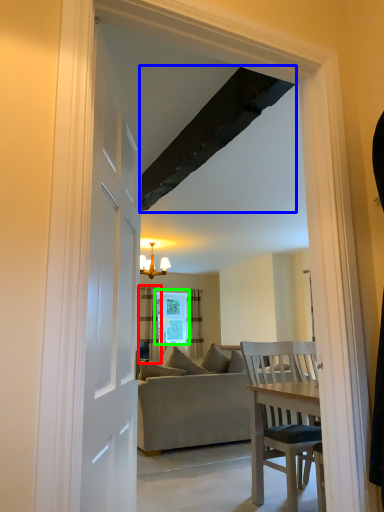
Question: Based on their relative distances, which object is nearer to curtain (highlighted by a red box)? Choose from exhaust hood (highlighted by a blue box) and window (highlighted by a green box).

Choices:
 (A) exhaust hood
 (B) window

Answer: (B)